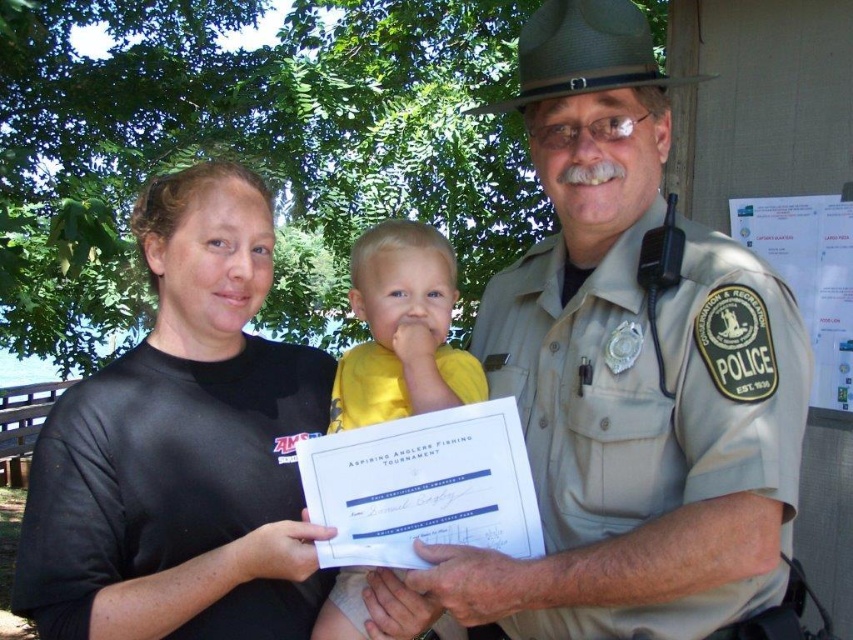
Question: Which of the following is the closest to the observer?

Choices:
 (A) (80, 419)
 (B) (670, 353)

Answer: (B)

Question: From the image, what is the correct spatial relationship of black matte shirt at center in relation to yellow cotton shirt at center?

Choices:
 (A) above
 (B) below

Answer: (B)

Question: Which of the following is the closest to the observer?

Choices:
 (A) yellow cotton shirt at center
 (B) black matte shirt at center

Answer: (B)

Question: From the image, what is the correct spatial relationship of black matte shirt at center in relation to yellow cotton shirt at center?

Choices:
 (A) right
 (B) left

Answer: (B)

Question: Can you confirm if black matte shirt at center is positioned to the right of yellow cotton shirt at center?

Choices:
 (A) yes
 (B) no

Answer: (B)

Question: Based on their relative distances, which object is farther from the yellow cotton shirt at center?

Choices:
 (A) black matte shirt at center
 (B) khaki uniform at center

Answer: (B)